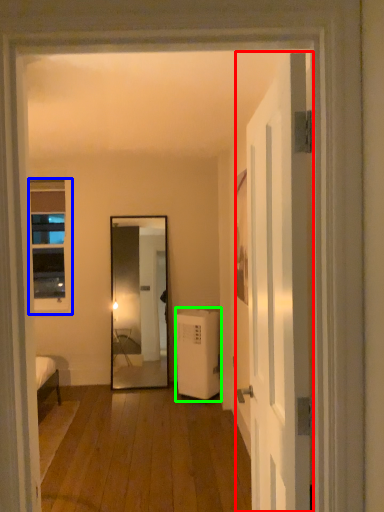
Question: Which object is the farthest from door (highlighted by a red box)? Choose among these: window (highlighted by a blue box) or air conditioner (highlighted by a green box).

Choices:
 (A) window
 (B) air conditioner

Answer: (A)